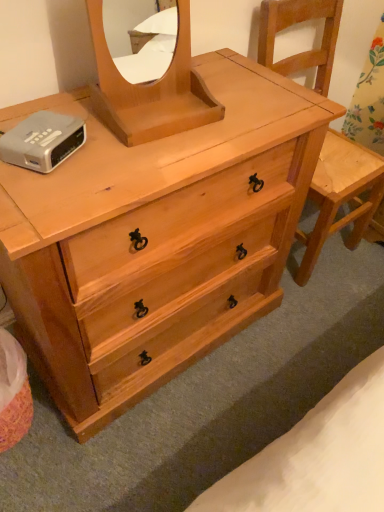
Question: Which is correct: silver metallic alarm clock at upper left is inside natural wood mirror at center, or outside of it?

Choices:
 (A) outside
 (B) inside

Answer: (A)

Question: Considering the positions of silver metallic alarm clock at upper left and natural wood mirror at center in the image, is silver metallic alarm clock at upper left taller or shorter than natural wood mirror at center?

Choices:
 (A) short
 (B) tall

Answer: (A)

Question: Estimate the real-world distances between objects in this image. Which object is farther from the natural wood mirror at center?

Choices:
 (A) natural wood chair at right
 (B) silver metallic alarm clock at upper left
 (C) natural wood dresser at center

Answer: (A)

Question: Estimate the real-world distances between objects in this image. Which object is farther from the natural wood mirror at center?

Choices:
 (A) natural wood dresser at center
 (B) natural wood chair at right
 (C) silver metallic alarm clock at upper left

Answer: (B)